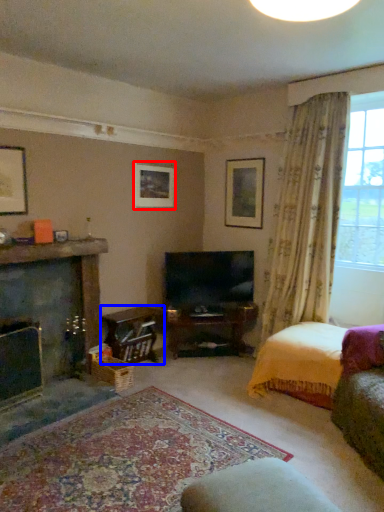
Question: Which point is closer to the camera, picture frame (highlighted by a red box) or table (highlighted by a blue box)?

Choices:
 (A) picture frame
 (B) table

Answer: (B)